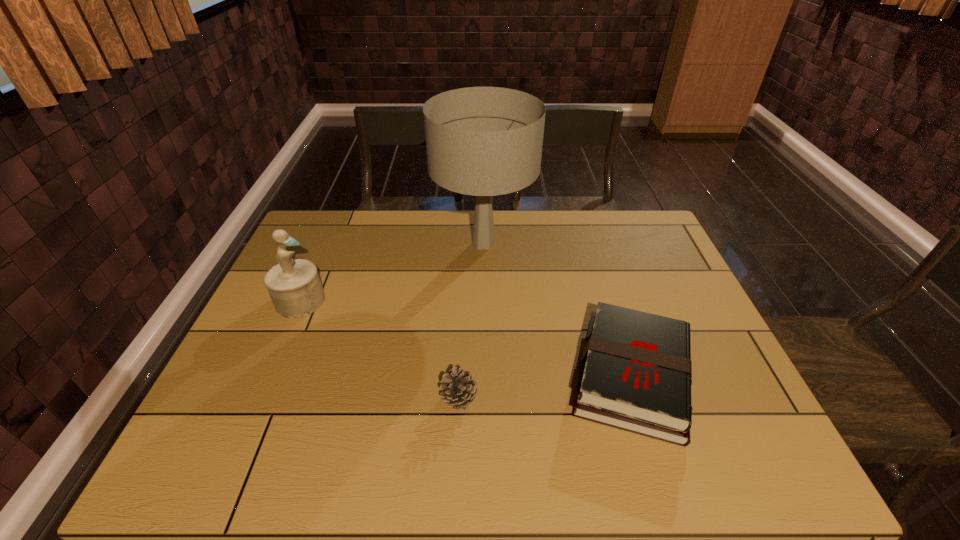
Locate an element on the screen. This screenshot has height=540, width=960. free space at the far left corner of the desktop is located at coordinates (318, 245).

Where is `vacant point at the near left corner`? vacant point at the near left corner is located at coordinates (224, 468).

I want to click on vacant space at the far right corner of the desktop, so click(x=659, y=249).

Where is `free point between the leftmost object and the tallest object`? This screenshot has height=540, width=960. free point between the leftmost object and the tallest object is located at coordinates (392, 272).

Find the location of a particular element. The image size is (960, 540). vacant space in between the figurine and the pinecone is located at coordinates (379, 349).

Locate an element on the screen. Image resolution: width=960 pixels, height=540 pixels. vacant space that's between the farthest object and the hardback book is located at coordinates (558, 310).

Where is `vacant space in between the hardback book and the farthest object`? vacant space in between the hardback book and the farthest object is located at coordinates (558, 310).

At what (x,y) coordinates should I click in order to perform the action: click on free spot between the pinecone and the lampshade. Please return your answer as a coordinate pair (x, y). Image resolution: width=960 pixels, height=540 pixels. Looking at the image, I should click on (471, 320).

Identify the location of vacant space that is in between the hardback book and the second tallest object. This screenshot has width=960, height=540. (466, 339).

Locate an element on the screen. The height and width of the screenshot is (540, 960). free space between the tallest object and the hardback book is located at coordinates (558, 310).